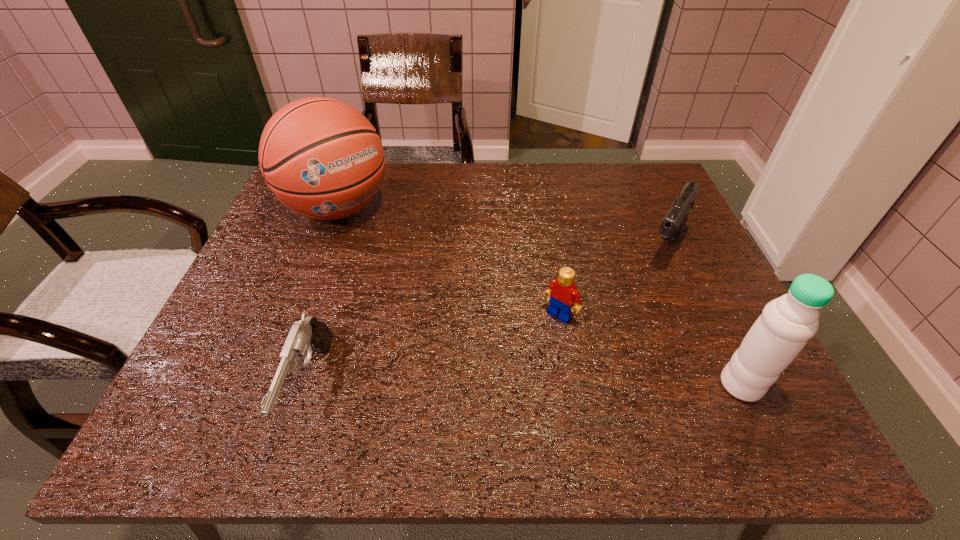
Find the location of a particular element. gun is located at coordinates (309, 334).

Locate an element on the screen. This screenshot has height=540, width=960. water bottle is located at coordinates (786, 324).

Locate an element on the screen. pistol is located at coordinates (672, 225).

The image size is (960, 540). What are the coordinates of `the third nearest object` in the screenshot? It's located at (562, 292).

Image resolution: width=960 pixels, height=540 pixels. Identify the location of the third object from right to left. (562, 292).

The height and width of the screenshot is (540, 960). What are the coordinates of `basketball` in the screenshot? It's located at (320, 157).

Locate an element on the screen. The image size is (960, 540). free location located on the left of the water bottle is located at coordinates click(526, 385).

The width and height of the screenshot is (960, 540). I want to click on vacant space located at the barrel of the pistol, so click(x=628, y=320).

The width and height of the screenshot is (960, 540). Find the location of `vacant space situated 0.340m at the barrel of the pistol`. vacant space situated 0.340m at the barrel of the pistol is located at coordinates (601, 366).

The image size is (960, 540). Identify the location of vacant space located 0.370m at the barrel of the pistol. (594, 376).